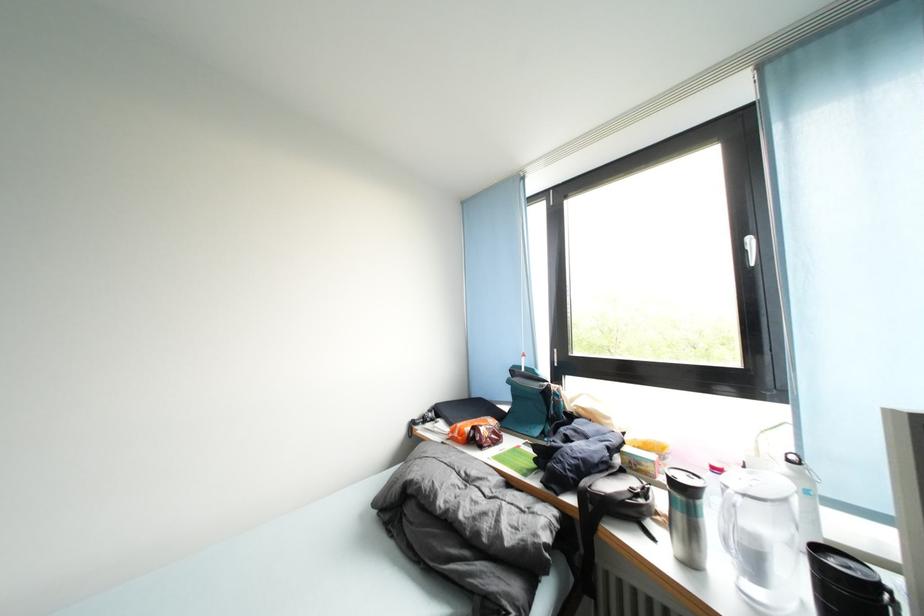
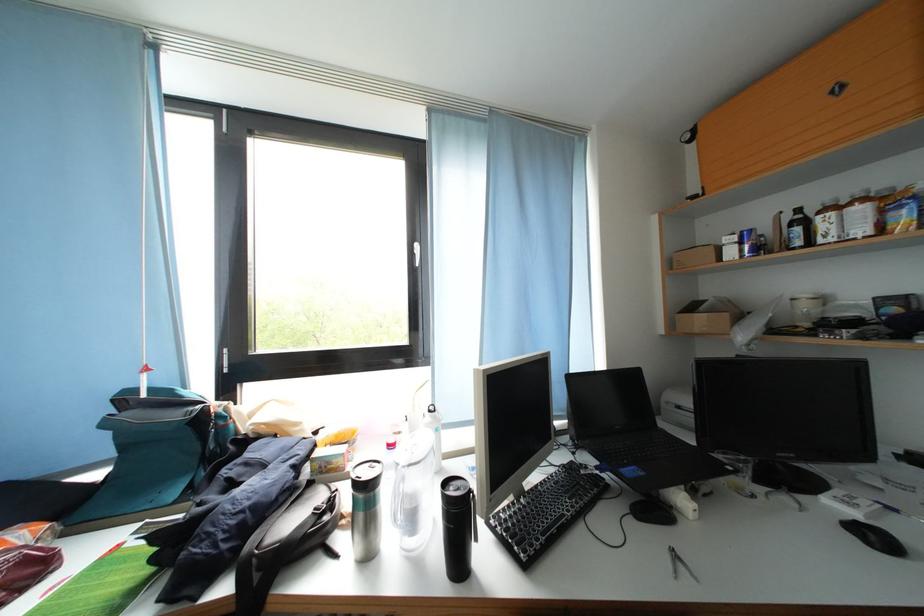
Question: The images are taken continuously from a first-person perspective. In which direction is your viewpoint rotating?

Choices:
 (A) Left
 (B) Right
 (C) Up
 (D) Down

Answer: (B)